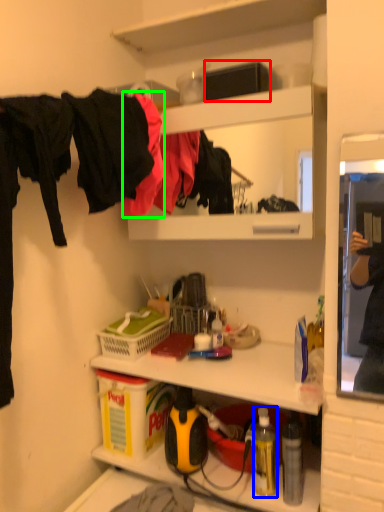
Question: Based on their relative distances, which object is nearer to box (highlighted by a red box)? Choose from bottle (highlighted by a blue box) and clothing (highlighted by a green box).

Choices:
 (A) bottle
 (B) clothing

Answer: (B)